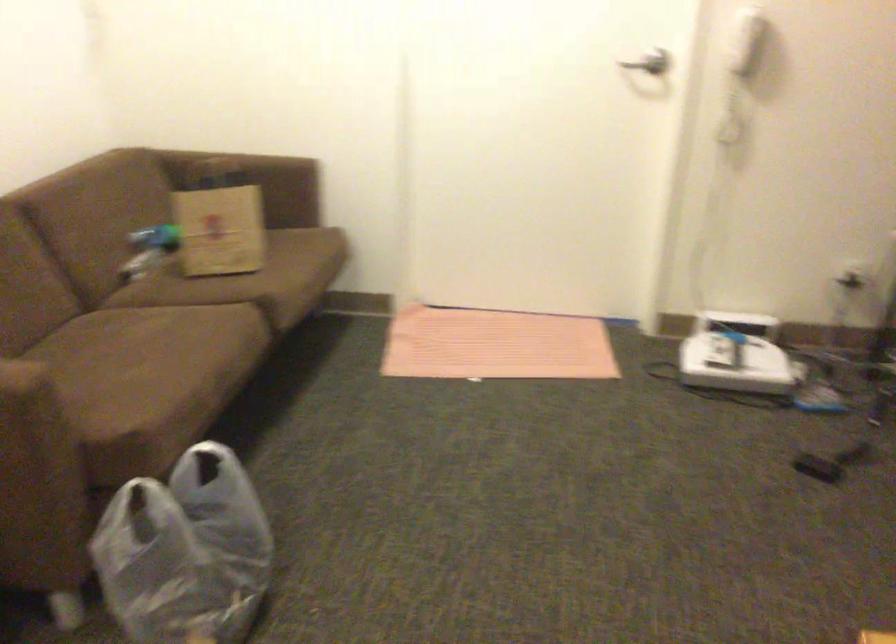
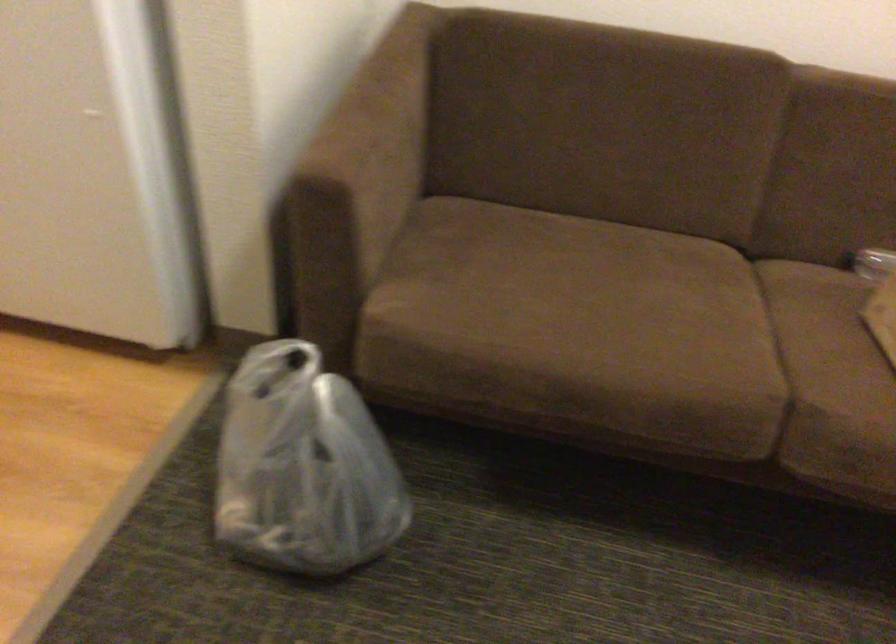
Locate, in the second image, the point that corresponds to (x=207, y=270) in the first image.

(882, 315)